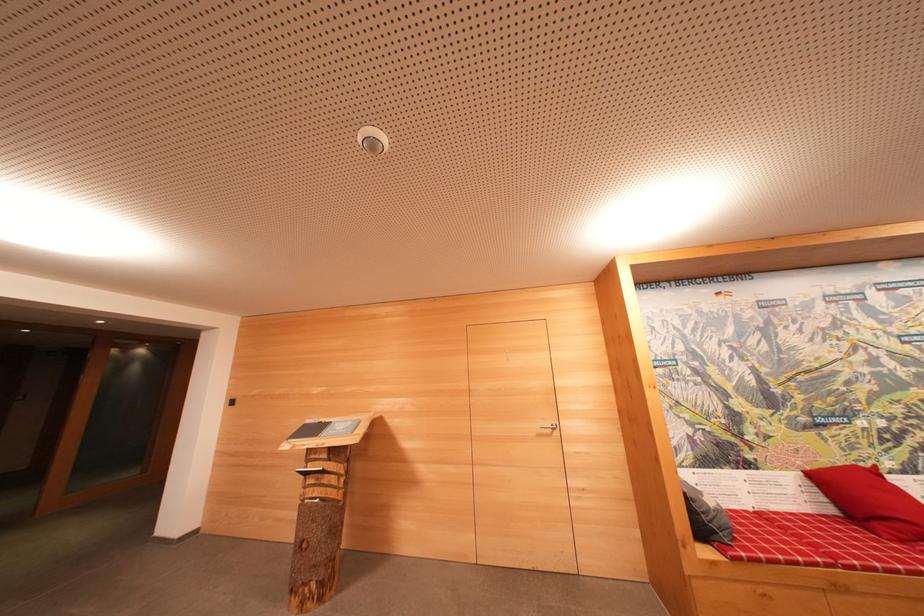
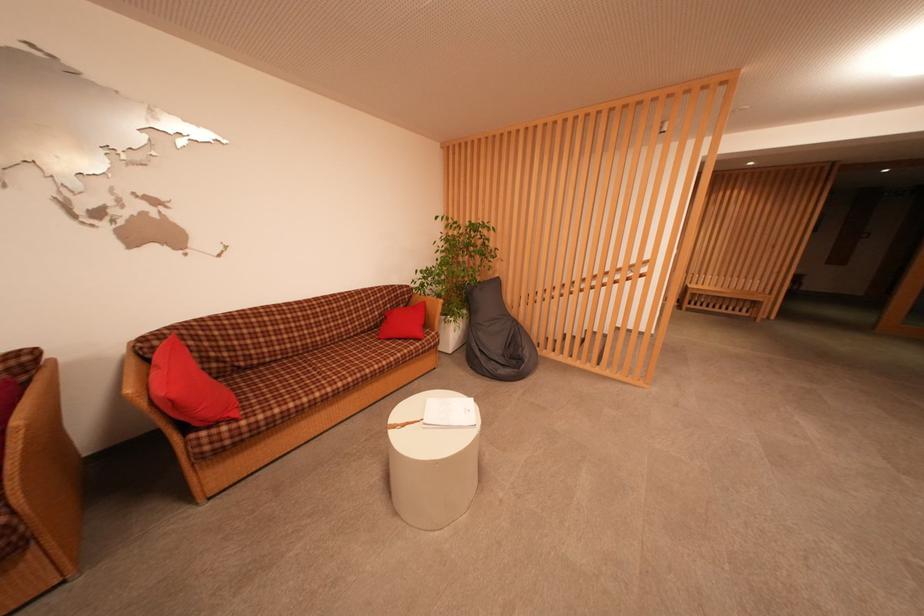
Question: Based on the continuous images, in which direction is the camera rotating? Reply with the corresponding letter.

Choices:
 (A) Left
 (B) Right
 (C) Up
 (D) Down

Answer: (A)